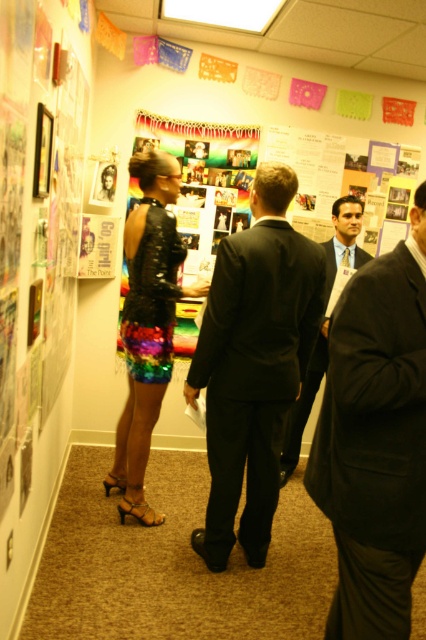
You are standing in the office and want to place a small plant between the two points, point (388, 538) and point (345, 243). Which point should the plant be closer to in order to be closer to the viewer?

The plant should be closer to point (388, 538) because it is closer to the viewer than point (345, 243).

You are organizing a formal event and need to arrange the black matte suit at center and the shiny black suit at center on a display rack. According to the scene, which one should be placed to the left of the other?

The black matte suit at center should be placed to the left of the shiny black suit at center because the description states that the black matte suit at center is to the left of the shiny black suit at center.